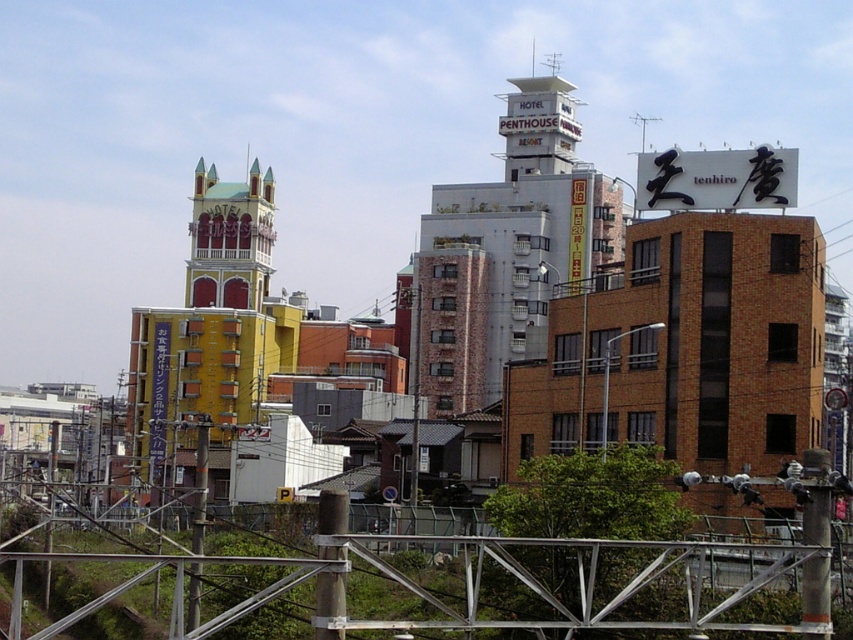
Does metallic gray rail at bottom come behind yellow matte building at center?

That is False.

What do you see at coordinates (428, 586) in the screenshot? This screenshot has width=853, height=640. I see `metallic gray rail at bottom` at bounding box center [428, 586].

Image resolution: width=853 pixels, height=640 pixels. In order to click on metallic gray rail at bottom in this screenshot , I will do `click(428, 586)`.

Does metallic gray rail at bottom have a greater width compared to white brick building at center?

Yes.

Can you confirm if metallic gray rail at bottom is positioned below white brick building at center?

Yes, metallic gray rail at bottom is below white brick building at center.

Where is `metallic gray rail at bottom`? metallic gray rail at bottom is located at coordinates (428, 586).

Which is above, white brick building at center or yellow matte building at center?

Positioned higher is white brick building at center.

Which is below, white brick building at center or yellow matte building at center?

yellow matte building at center

Does point (434, 252) lie in front of point (157, 328)?

Yes, it is in front of point (157, 328).

Where is `white brick building at center`? The image size is (853, 640). white brick building at center is located at coordinates (506, 250).